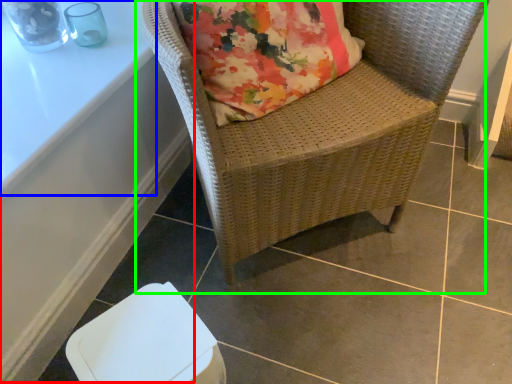
Question: Estimate the real-world distances between objects in this image. Which object is farther from table (highlighted by a red box), table (highlighted by a blue box) or chair (highlighted by a green box)?

Choices:
 (A) table
 (B) chair

Answer: (B)